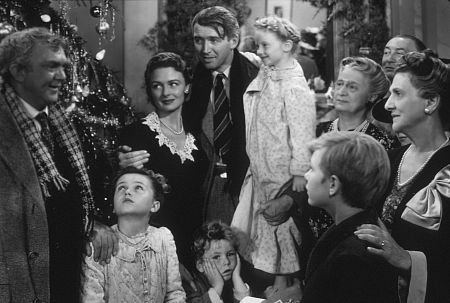
Locate an element on the screen. This screenshot has height=303, width=450. christmas tree is located at coordinates (84, 84).